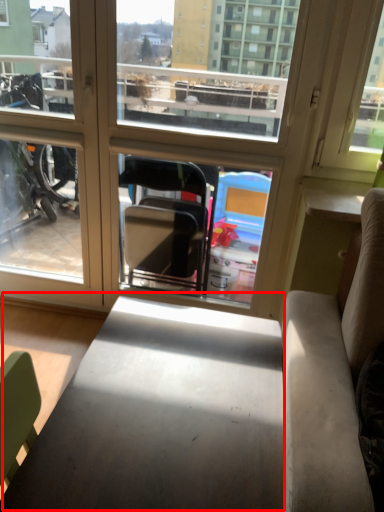
Question: Considering the relative positions of table (annotated by the red box) and window in the image provided, where is table (annotated by the red box) located with respect to the staircase?

Choices:
 (A) right
 (B) left

Answer: (A)